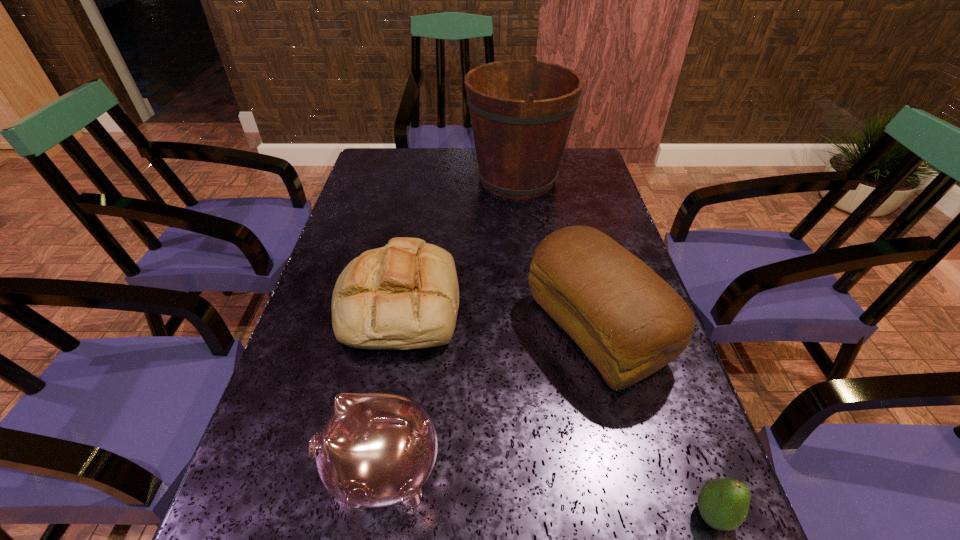
Locate an element on the screen. avocado positioned at the right edge is located at coordinates (723, 503).

In order to click on object that is at the far right corner in this screenshot , I will do `click(521, 111)`.

The image size is (960, 540). Identify the location of vacant area at the far edge of the desktop. (460, 155).

The width and height of the screenshot is (960, 540). In the image, there is a desktop. What are the coordinates of `free space at the left edge` in the screenshot? It's located at (293, 434).

Where is `free space at the right edge`? This screenshot has width=960, height=540. free space at the right edge is located at coordinates (590, 224).

In the image, there is a desktop. At what (x,y) coordinates should I click in order to perform the action: click on vacant space at the far left corner. Please return your answer as a coordinate pair (x, y). The image size is (960, 540). Looking at the image, I should click on (406, 152).

This screenshot has height=540, width=960. Find the location of `free space at the far right corner`. free space at the far right corner is located at coordinates tap(576, 153).

Identify the location of free space between the second shortest object and the bucket. (458, 241).

Where is `vacant area that lies between the right bread and the piggy bank`? vacant area that lies between the right bread and the piggy bank is located at coordinates (490, 401).

Identify the location of vacant space that's between the tallest object and the shorter bread. This screenshot has width=960, height=540. (458, 241).